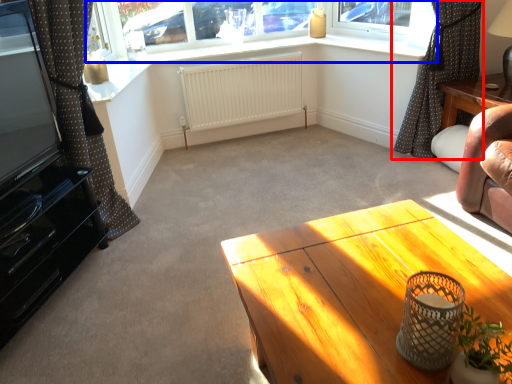
Question: Among these objects, which one is nearest to the camera, curtain (highlighted by a red box) or window (highlighted by a blue box)?

Choices:
 (A) curtain
 (B) window

Answer: (A)